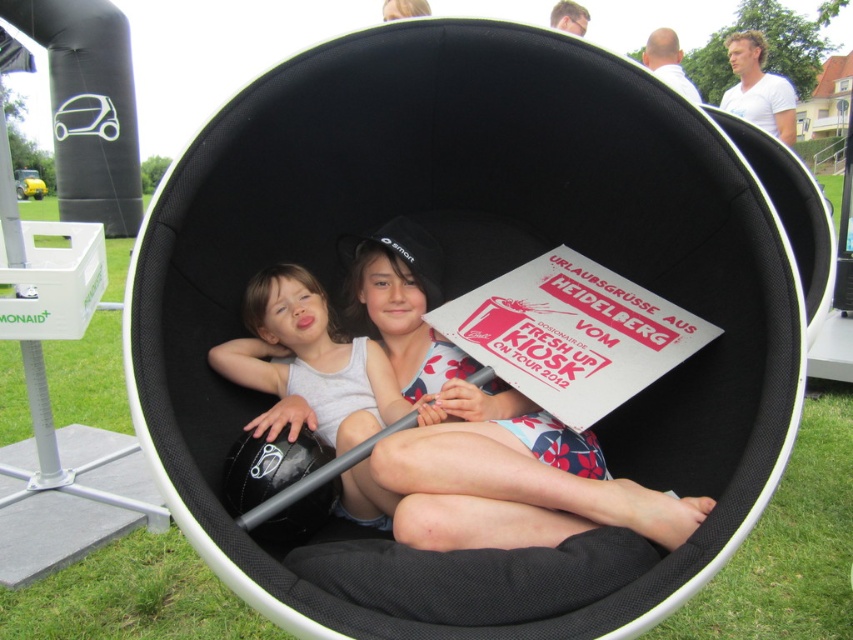
Can you confirm if matte black hat at center is thinner than matte white tank top at center?

No.

Can you confirm if matte black hat at center is smaller than matte white tank top at center?

Incorrect, matte black hat at center is not smaller in size than matte white tank top at center.

Describe the element at coordinates (480, 435) in the screenshot. I see `matte black hat at center` at that location.

I want to click on matte black hat at center, so (480, 435).